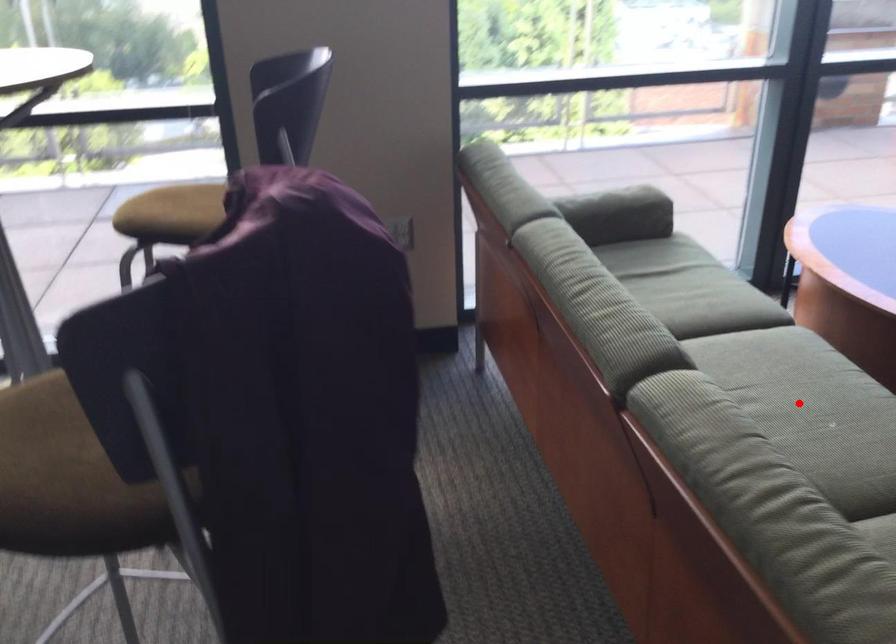
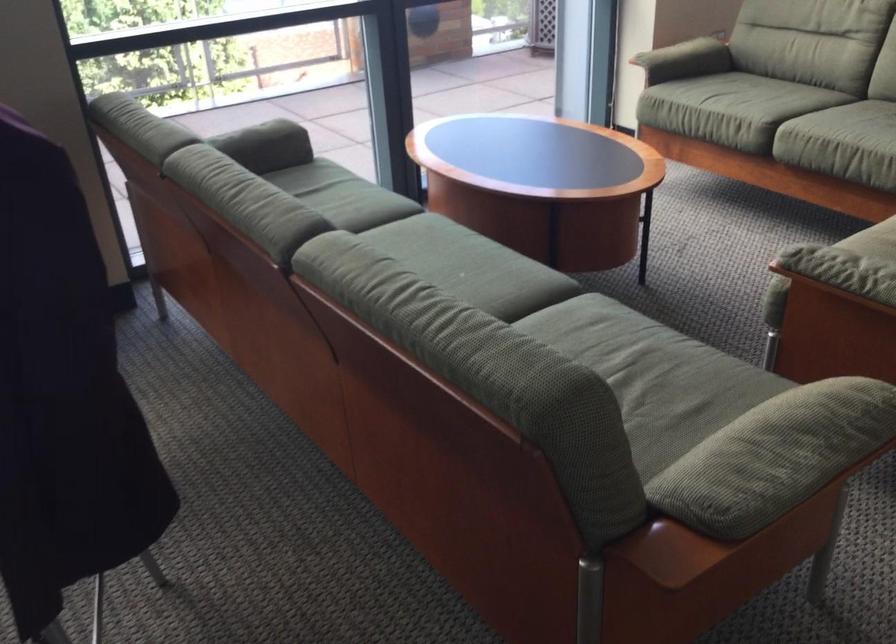
Where in the second image is the point corresponding to the highlighted location from the first image?

(442, 267)